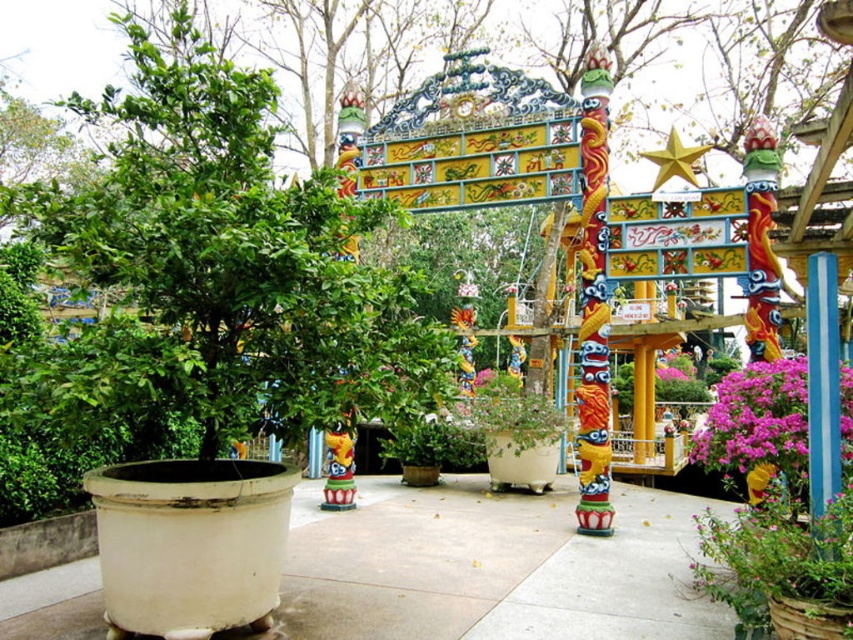
Question: Which point is closer to the camera?

Choices:
 (A) purple matte flowers at center right
 (B) purple matte flower at center
 (C) green matte tree at center

Answer: (C)

Question: Is white concrete pavement at center further to the viewer compared to purple matte flowers at center right?

Choices:
 (A) yes
 (B) no

Answer: (B)

Question: Is white concrete pavement at center to the right of purple matte flowers at center right from the viewer's perspective?

Choices:
 (A) no
 (B) yes

Answer: (A)

Question: Does white concrete pavement at center have a smaller size compared to purple matte flowers at center right?

Choices:
 (A) yes
 (B) no

Answer: (B)

Question: Which of the following is the closest to the observer?

Choices:
 (A) white concrete pavement at center
 (B) purple matte flowers at center right
 (C) green matte tree at center

Answer: (C)

Question: Among these points, which one is nearest to the camera?

Choices:
 (A) pyautogui.click(x=303, y=403)
 (B) pyautogui.click(x=62, y=611)

Answer: (A)